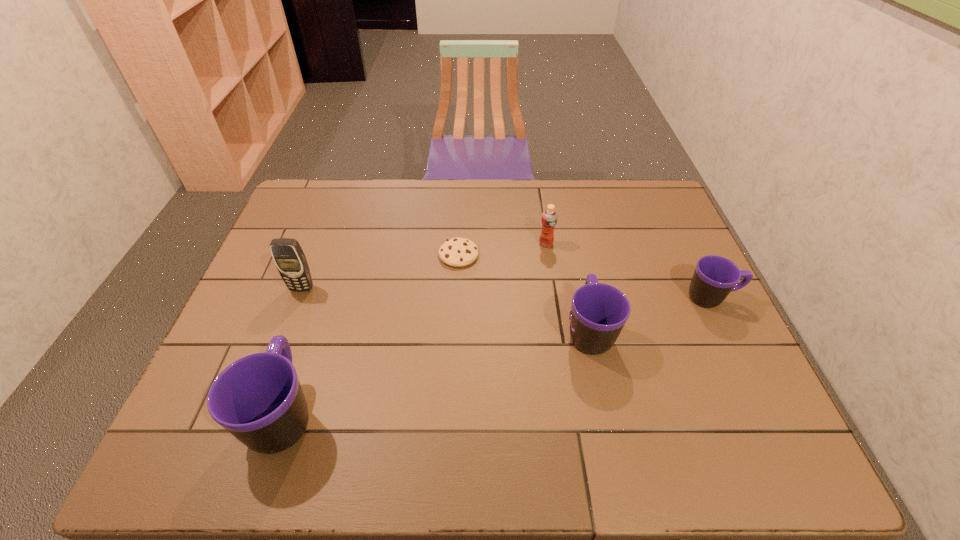
The height and width of the screenshot is (540, 960). I want to click on mug that stands as the second closest to the fourth object from right to left, so click(x=258, y=398).

This screenshot has height=540, width=960. I want to click on vacant space that satisfies the following two spatial constraints: 1. with the handle on the side of the orange juice; 2. on the right side of the tallest mug, so click(x=341, y=244).